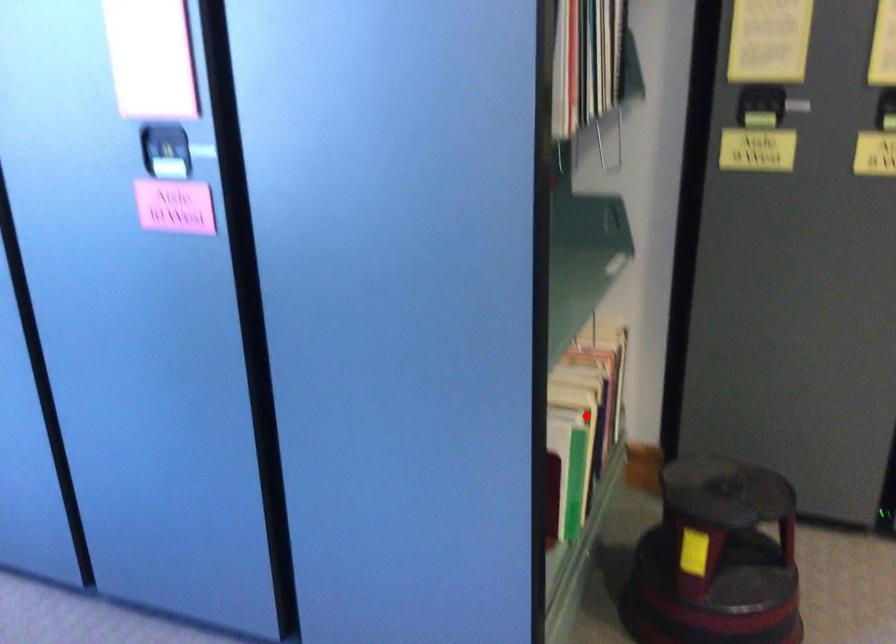
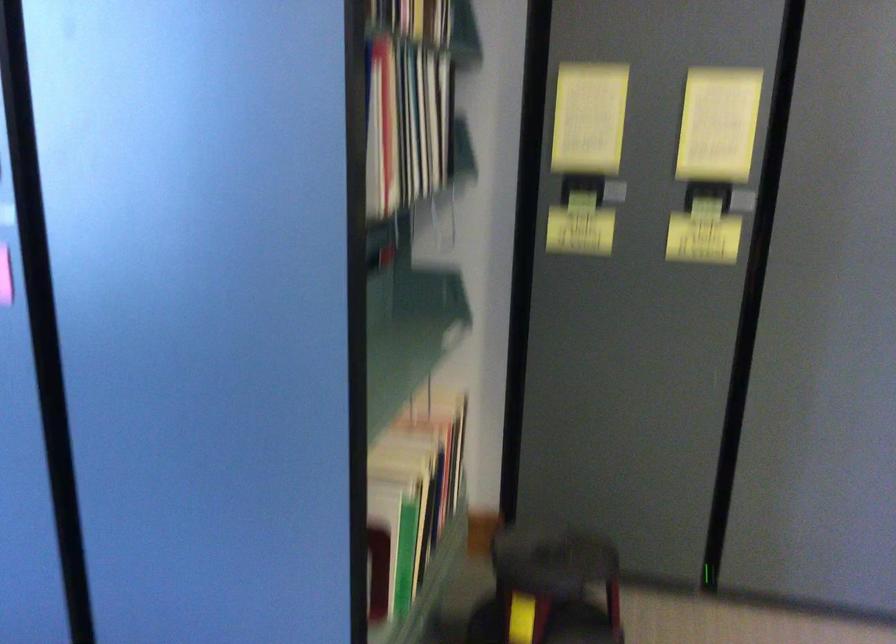
Question: I am providing you with two images of the same scene from different viewpoints. A red point is marked on the first image. Is the red point's position out of view in image 2?

Choices:
 (A) Yes
 (B) No

Answer: (B)